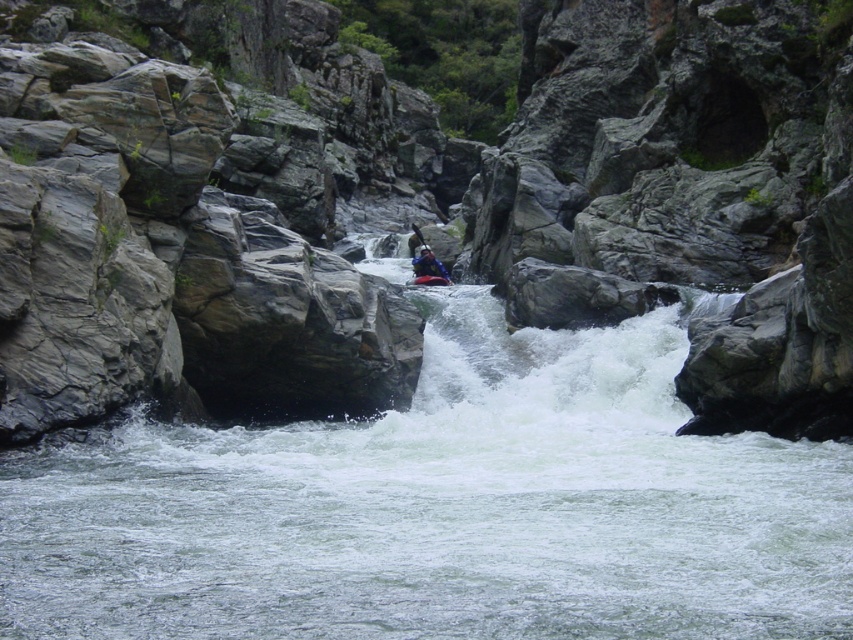
You are a kayaker trying to navigate through the white frothy water at center and the red plastic canoe at center. Based on the scene, which object is wider?

The white frothy water at center is wider than the red plastic canoe at center.

Consider the image. You are a photographer positioned at the camera location capturing this whitewater kayaking scene. You want to ensure both the point at coordinates point [71,525] and the point at coordinates point [447,284] are in focus. Which point should you focus on first to ensure the closest object is sharp?

Point [71,525] is closer to the camera than point [447,284], so you should focus on point [71,525] first to ensure the closest object is sharp.

Consider the image. You are navigating a kayak through the rapids in the canyon. You spot two points in the river, one at coordinates point (840, 282) and the other at point (410, 228). Which point should you aim for if you want to take the shortest path towards the canyon exit located downstream?

You should aim for point (410, 228) because it is positioned behind point (840, 282). Since the canyon exit is downstream, the point that is further ahead in the current would lead you closer to the exit more quickly.